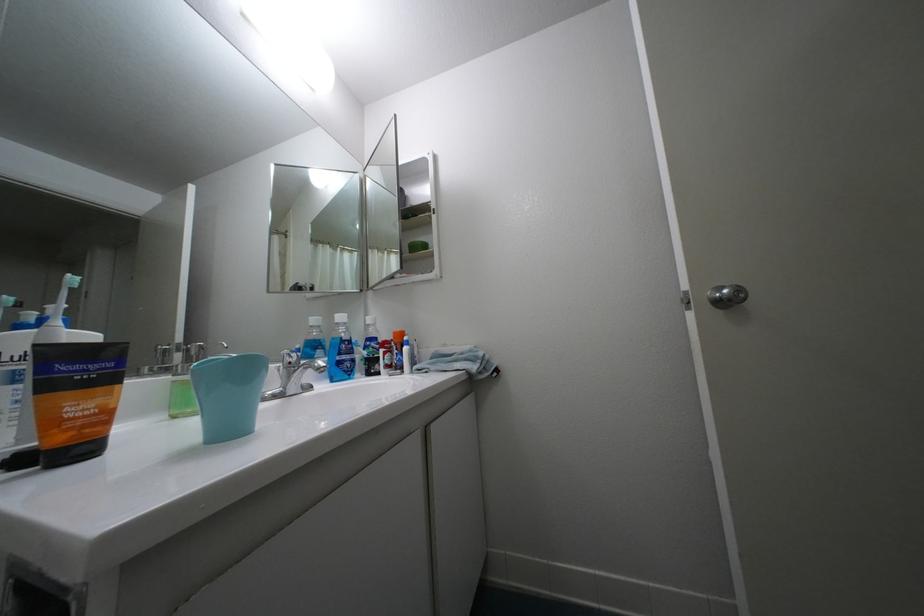
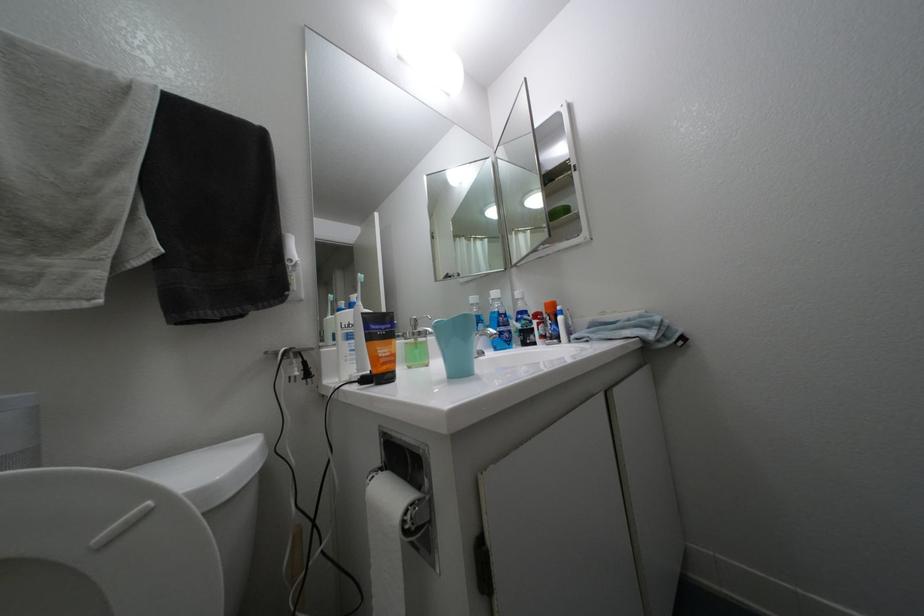
Question: Based on the continuous images, in which direction is the camera rotating? Reply with the corresponding letter.

Choices:
 (A) Left
 (B) Right
 (C) Up
 (D) Down

Answer: (A)